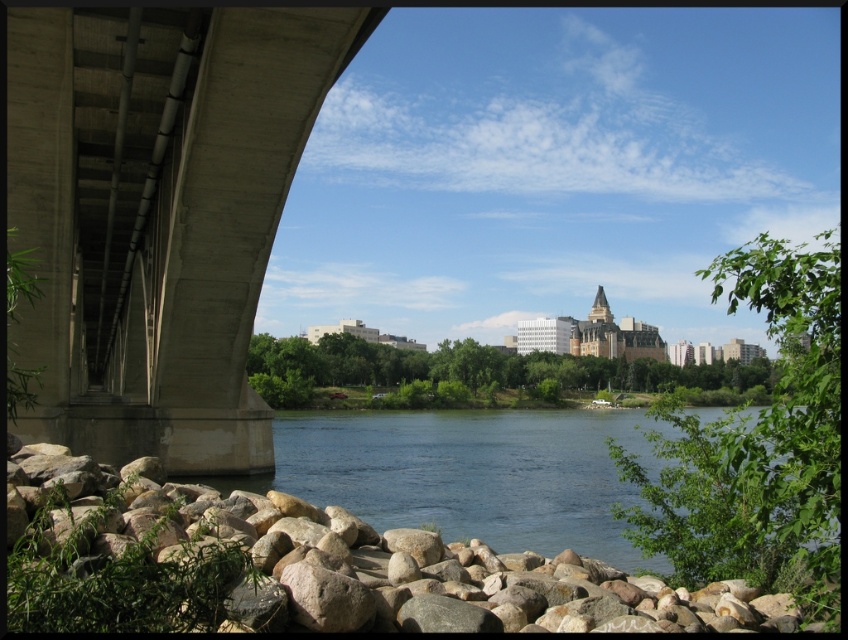
Can you confirm if concrete bridge at left is positioned to the left of smooth brown rock at lower left?

Indeed, concrete bridge at left is positioned on the left side of smooth brown rock at lower left.

Image resolution: width=848 pixels, height=640 pixels. What do you see at coordinates (159, 214) in the screenshot?
I see `concrete bridge at left` at bounding box center [159, 214].

Where is `concrete bridge at left`? The image size is (848, 640). concrete bridge at left is located at coordinates (159, 214).